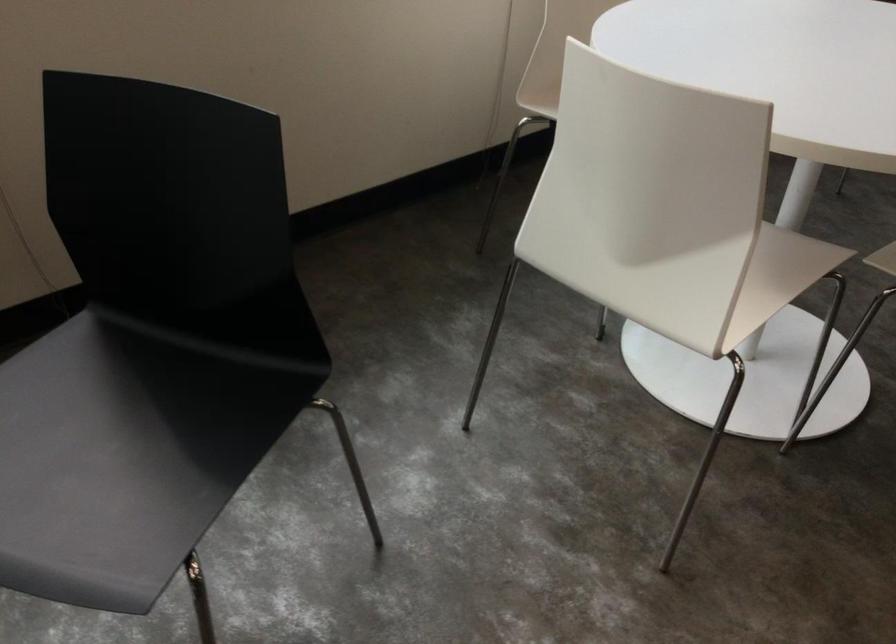
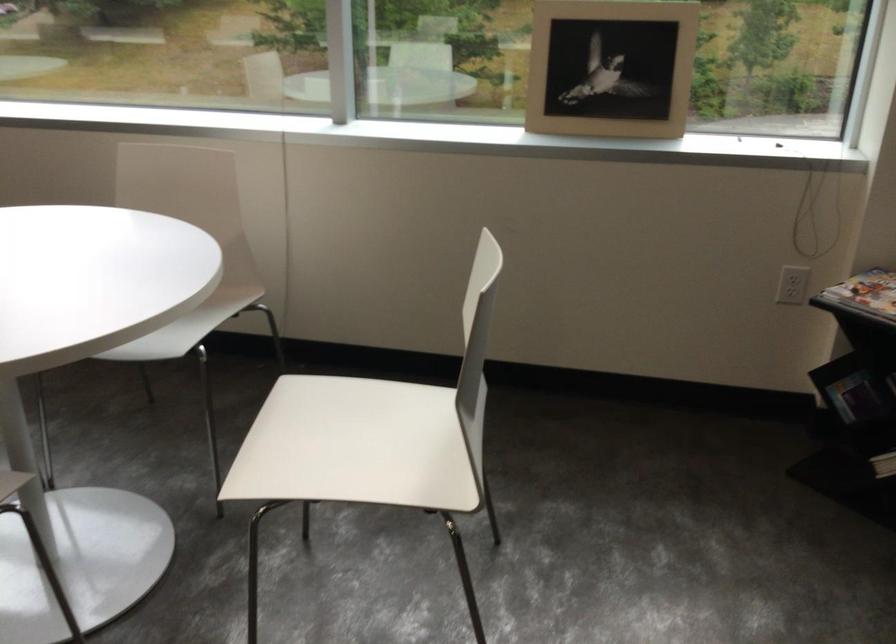
Question: I am providing you with two images of the same scene from different viewpoints. Please identify which objects are invisible in image2.

Choices:
 (A) magazine on rack
 (B) white chair sitting surface
 (C) picture frame
 (D) black tripod knob

Answer: (B)